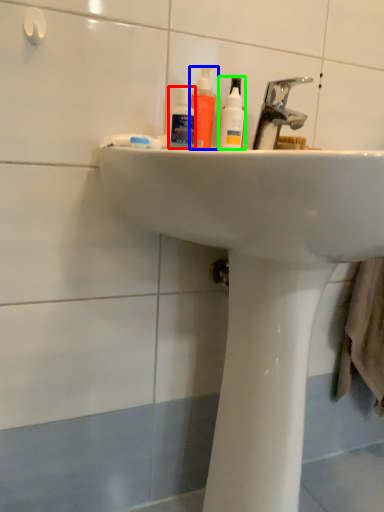
Question: Based on their relative distances, which object is farther from mouthwash (highlighted by a red box)? Choose from mouthwash (highlighted by a blue box) and cleaning product (highlighted by a green box).

Choices:
 (A) mouthwash
 (B) cleaning product

Answer: (B)